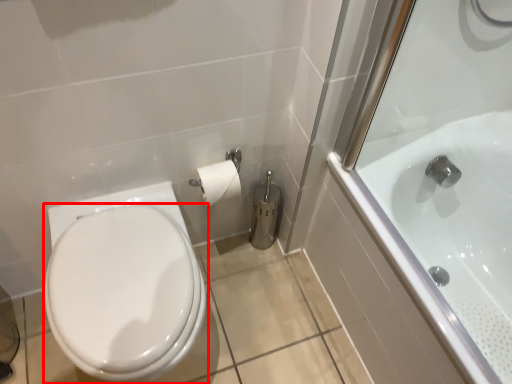
Question: Where is bidet (annotated by the red box) located in relation to bathtub in the image?

Choices:
 (A) left
 (B) right

Answer: (A)